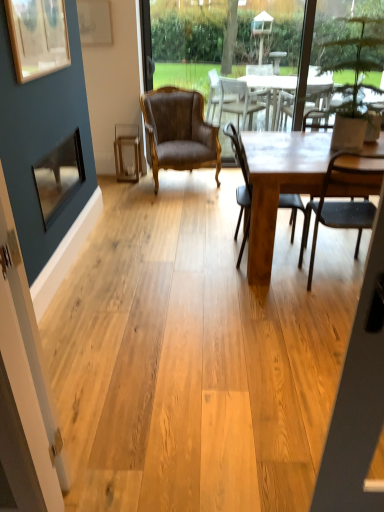
Locate an element on the screen. Image resolution: width=384 pixels, height=512 pixels. free point below wooden picture frame at upper left, which ranks as the second picture frame in bottom-to-top order (from a real-world perspective) is located at coordinates (69, 229).